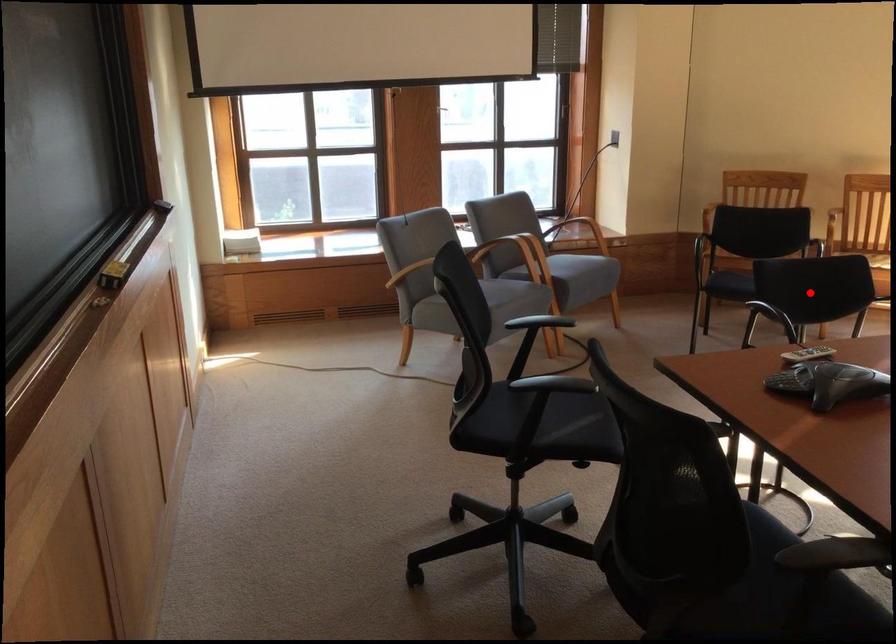
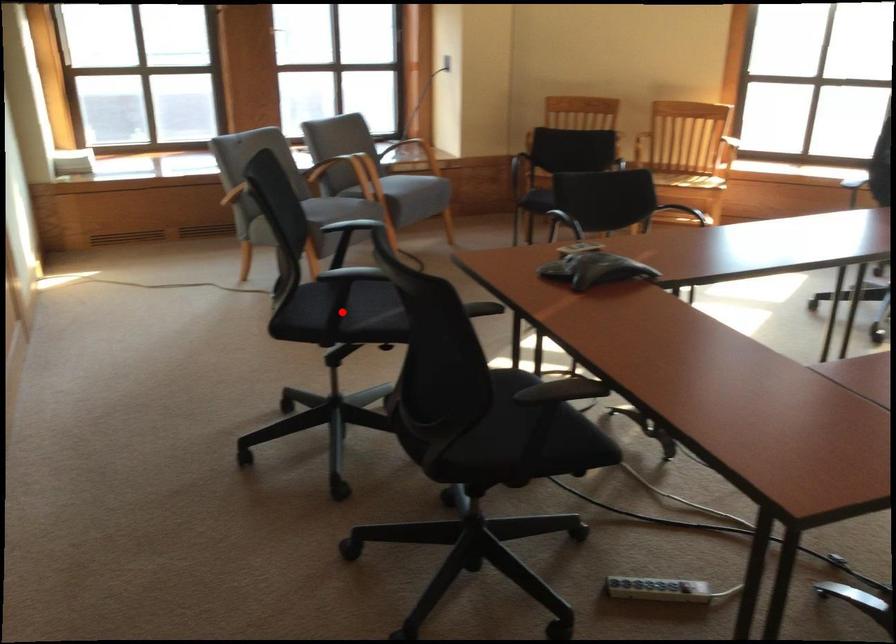
I am providing you with two images of the same scene from different viewpoints. A red point is marked on the first image and another point is marked on the second image. Do the highlighted points in image1 and image2 indicate the same real-world spot?

No